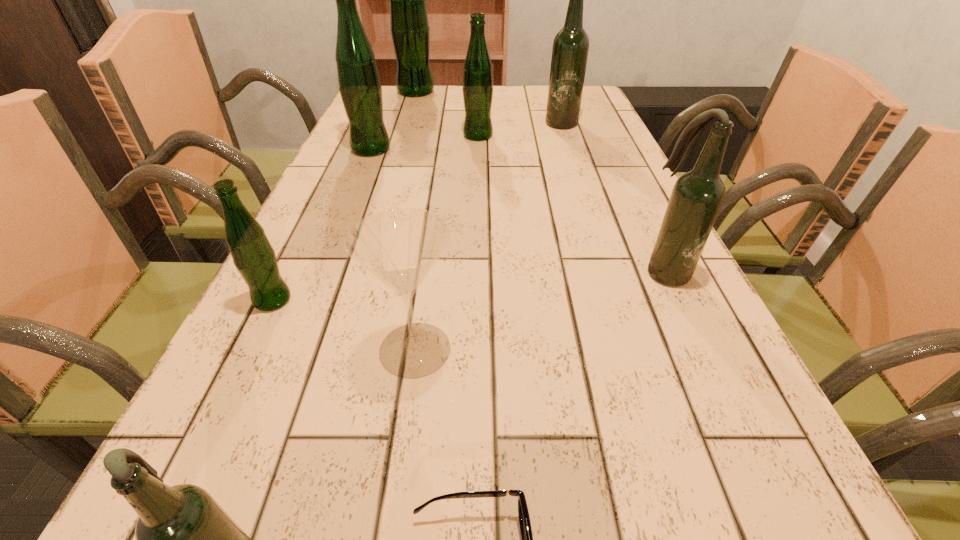
Image resolution: width=960 pixels, height=540 pixels. I want to click on green beer bottle that is the second closest to the tallest object, so click(x=360, y=88).

This screenshot has width=960, height=540. What are the coordinates of `dark beer bottle that is the second closest to the nearest dark beer bottle` in the screenshot? It's located at (570, 49).

Locate which dark beer bottle ranks second in proximity to the rightmost object. Please provide its 2D coordinates. Your answer should be formatted as a tuple, i.e. [(x, y)], where the tuple contains the x and y coordinates of a point satisfying the conditions above.

[(184, 539)]

You are a GUI agent. You are given a task and a screenshot of the screen. Output one action in this format:
    pyautogui.click(x=<x>, y=<y>)
    Task: Click on the free space that satisfies the following two spatial constraints: 1. on the front side of the biggest green beer bottle; 2. on the left side of the second biggest dark beer bottle
    The image size is (960, 540).
    Given the screenshot: What is the action you would take?
    pyautogui.click(x=362, y=272)

The width and height of the screenshot is (960, 540). I want to click on free space that satisfies the following two spatial constraints: 1. on the back side of the farthest dark beer bottle; 2. on the left side of the flute glass, so click(x=446, y=121).